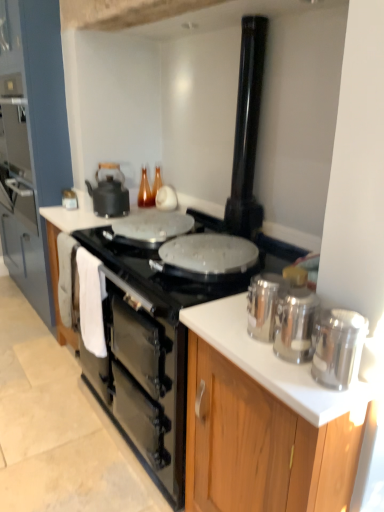
Question: Based on their sizes in the image, would you say silver metallic canisters at right, which is the 2th kitchen appliance from top to bottom, is bigger or smaller than white glossy countertop at center?

Choices:
 (A) small
 (B) big

Answer: (A)

Question: Is silver metallic canisters at right, which is the 2th kitchen appliance from top to bottom, in front of or behind white glossy countertop at center in the image?

Choices:
 (A) front
 (B) behind

Answer: (A)

Question: Which object is positioned closest to the white glossy countertop at center?

Choices:
 (A) silver metallic canisters at right, positioned as the 2th kitchen appliance in back-to-front order
 (B) polished stainless steel canisters at right, positioned as the third kitchen appliance in left-to-right order
 (C) black matte gas stove at center
 (D) black matte oven at center
 (E) polished stainless steel canisters at right, the 4th kitchen appliance when ordered from back to front

Answer: (E)

Question: Estimate the real-world distances between objects in this image. Which object is farther from the black glossy chimney at upper center?

Choices:
 (A) polished stainless steel canisters at right, the 4th kitchen appliance from the left
 (B) polished stainless steel canisters at right, arranged as the second kitchen appliance when ordered from the bottom
 (C) wooden cabinet at left, which is the 2th cabinetry from front to back
 (D) black matte oven at center
 (E) silver metallic canisters at right, the 1th cabinetry when ordered from right to left

Answer: (C)